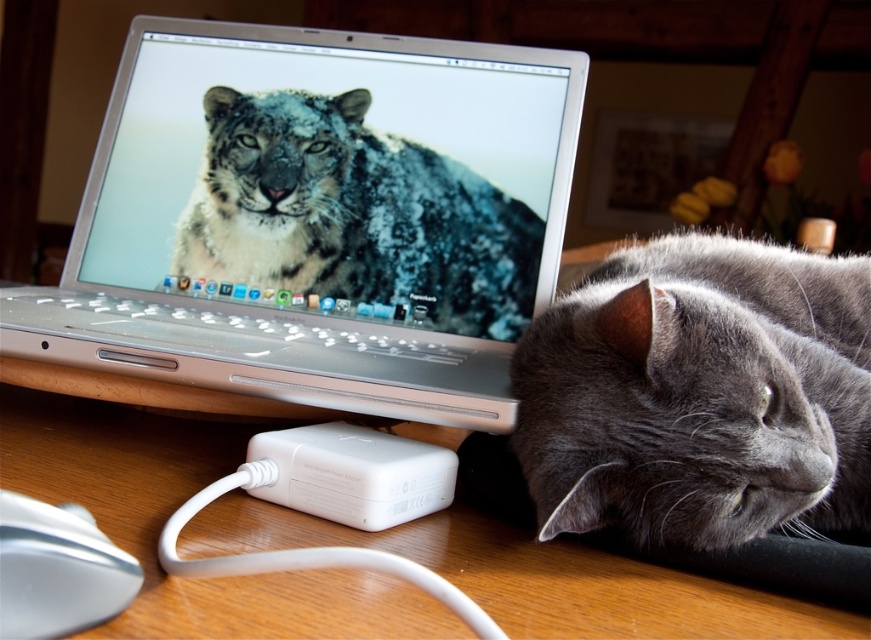
Locate an element on the screen. The width and height of the screenshot is (871, 640). silver metallic laptop at upper left is located at coordinates coord(314,168).

Between silver metallic laptop at upper left and white glossy mouse at lower left, which one has less height?

With less height is white glossy mouse at lower left.

Is point (550, 84) behind point (46, 611)?

That is True.

I want to click on silver metallic laptop at upper left, so click(x=314, y=168).

Can you confirm if snowy fur snow leopard at center is smaller than white plastic power adapter at lower center?

Incorrect, snowy fur snow leopard at center is not smaller in size than white plastic power adapter at lower center.

Is snowy fur snow leopard at center above white plastic power adapter at lower center?

Yes, snowy fur snow leopard at center is above white plastic power adapter at lower center.

Image resolution: width=871 pixels, height=640 pixels. I want to click on snowy fur snow leopard at center, so click(353, 214).

Which is more to the left, silver metallic laptop at upper left or snowy fur snow leopard at center?

silver metallic laptop at upper left

Who is more distant from viewer, (x=177, y=157) or (x=410, y=228)?

Positioned behind is point (x=177, y=157).

This screenshot has width=871, height=640. What do you see at coordinates (314, 168) in the screenshot?
I see `silver metallic laptop at upper left` at bounding box center [314, 168].

Find the location of a particular element. silver metallic laptop at upper left is located at coordinates (314, 168).